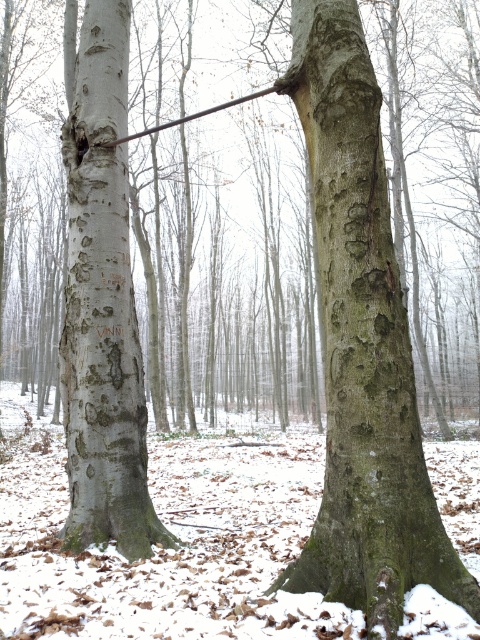
Can you confirm if green rough bark tree trunk at center is positioned to the left of smooth gray bark at left?

No, green rough bark tree trunk at center is not to the left of smooth gray bark at left.

Which of these two, green rough bark tree trunk at center or smooth gray bark at left, stands shorter?

green rough bark tree trunk at center is shorter.

Locate an element on the screen. The width and height of the screenshot is (480, 640). green rough bark tree trunk at center is located at coordinates (361, 346).